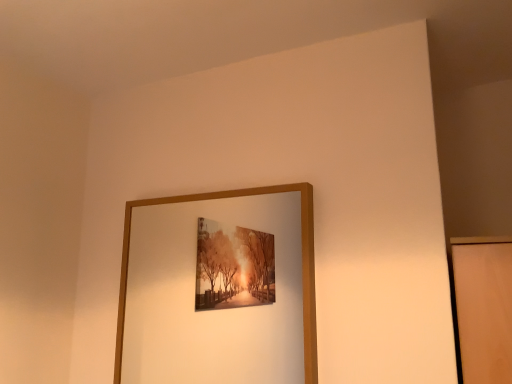
What is the approximate width of wooden picture frame at upper center?

It is 2.59 inches.

What are the coordinates of `wooden picture frame at upper center` in the screenshot? It's located at (302, 265).

What do you see at coordinates (302, 265) in the screenshot?
I see `wooden picture frame at upper center` at bounding box center [302, 265].

In order to face wooden picture frame at upper center, should I rotate leftwards or rightwards?

Rotate your view left by about 6.914°.

The image size is (512, 384). Identify the location of wooden picture frame at upper center. pyautogui.click(x=302, y=265).